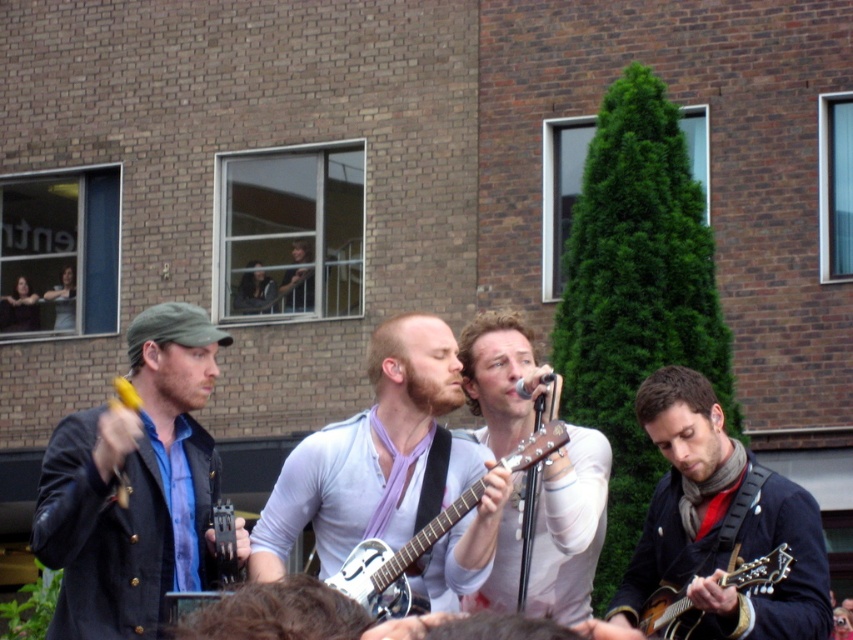
Question: In this image, where is light purple silky scarf at center located relative to wooden acoustic guitar at lower right?

Choices:
 (A) right
 (B) left

Answer: (B)

Question: Among these points, which one is farthest from the camera?

Choices:
 (A) (396, 323)
 (B) (741, 452)
 (C) (184, 563)

Answer: (B)

Question: Which point appears farthest from the camera in this image?

Choices:
 (A) coord(393,564)
 (B) coord(80,468)

Answer: (A)

Question: Can you confirm if light purple silky scarf at center is positioned below dark blue jacket at center?

Choices:
 (A) yes
 (B) no

Answer: (B)

Question: Observing the image, what is the correct spatial positioning of light purple silky scarf at center in reference to dark blue jacket at center?

Choices:
 (A) below
 (B) above

Answer: (B)

Question: Which of the following is the closest to the observer?

Choices:
 (A) wooden acoustic guitar at lower right
 (B) matte black jacket at left
 (C) dark blue jacket at center
 (D) metallic silver resonator guitar at center

Answer: (B)